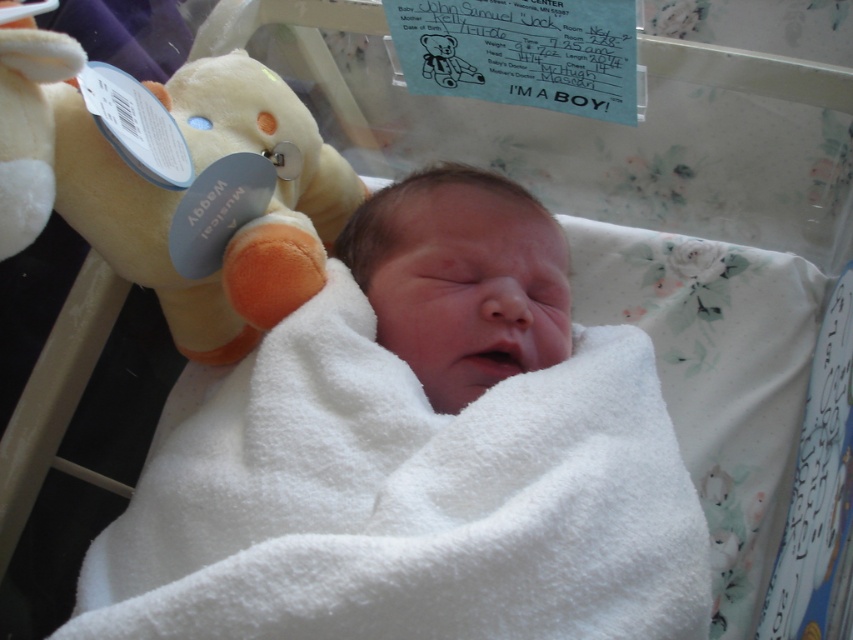
Question: Is soft plush bear at upper left positioned behind smooth white newborn at center?

Choices:
 (A) no
 (B) yes

Answer: (A)

Question: Does soft plush bear at upper left appear on the left side of smooth white newborn at center?

Choices:
 (A) yes
 (B) no

Answer: (A)

Question: Can you confirm if soft plush bear at upper left is bigger than smooth white newborn at center?

Choices:
 (A) yes
 (B) no

Answer: (A)

Question: Which point is farther from the camera taking this photo?

Choices:
 (A) (238, 257)
 (B) (492, 266)

Answer: (B)